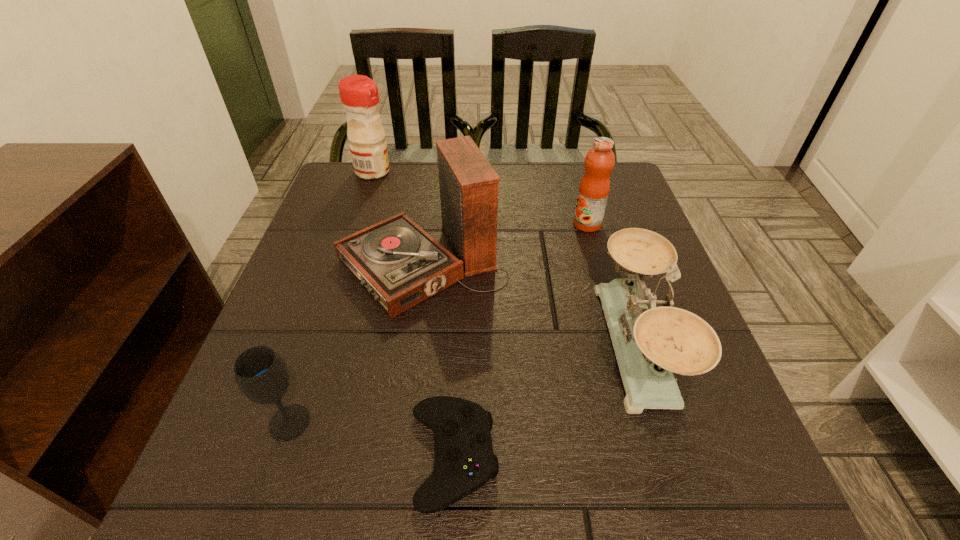
Find the location of a particular element. wineglass at the left edge is located at coordinates (261, 374).

Identify the location of fruit juice that is at the right edge. This screenshot has width=960, height=540. (594, 188).

Locate an element on the screen. scale located at the right edge is located at coordinates (651, 344).

Identify the location of object that is at the far left corner. (359, 94).

You are a GUI agent. You are given a task and a screenshot of the screen. Output one action in this format:
    pyautogui.click(x=<x>, y=<y>)
    Task: Click on the vacant space at the far edge of the desktop
    The image size is (960, 540).
    Given the screenshot: What is the action you would take?
    pyautogui.click(x=560, y=190)

Locate an element on the screen. free region at the near edge of the desktop is located at coordinates (x=420, y=463).

Image resolution: width=960 pixels, height=540 pixels. Find the location of `vacant space at the left edge of the desktop`. vacant space at the left edge of the desktop is located at coordinates (342, 330).

The height and width of the screenshot is (540, 960). I want to click on vacant area at the right edge of the desktop, so click(586, 233).

In the image, there is a desktop. At what (x,y) coordinates should I click in order to perform the action: click on vacant region at the far left corner. Please return your answer as a coordinate pair (x, y). Looking at the image, I should click on (322, 201).

Where is `free spot at the near left corner of the desktop`? The image size is (960, 540). free spot at the near left corner of the desktop is located at coordinates (234, 481).